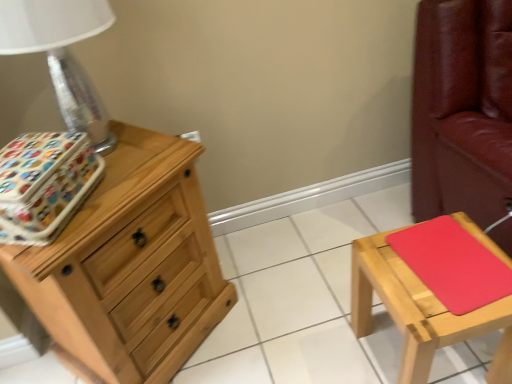
The height and width of the screenshot is (384, 512). I want to click on vacant space positioned to the left of matte wood stool at right, so click(x=318, y=341).